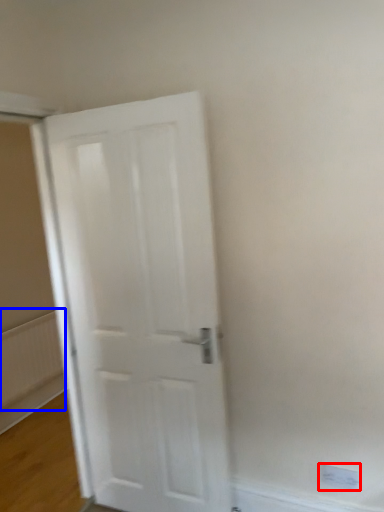
Question: Which point is closer to the camera, electric outlet (highlighted by a red box) or radiator (highlighted by a blue box)?

Choices:
 (A) electric outlet
 (B) radiator

Answer: (A)